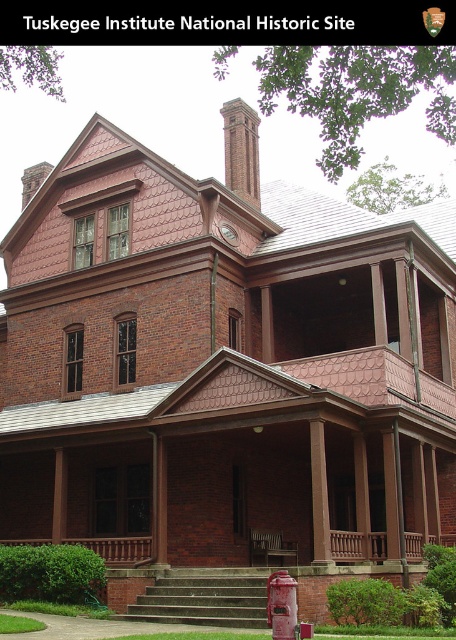
Question: Does brown wood porch at lower center have a smaller size compared to rustic metal fire hydrant at lower center?

Choices:
 (A) no
 (B) yes

Answer: (A)

Question: Does rustic metal fire hydrant at lower center have a larger size compared to metallic silver bench at center?

Choices:
 (A) yes
 (B) no

Answer: (B)

Question: Among these points, which one is farthest from the camera?

Choices:
 (A) (310, 630)
 (B) (280, 556)

Answer: (B)

Question: Which point is closer to the camera?

Choices:
 (A) (299, 634)
 (B) (70, 538)

Answer: (A)

Question: Does metallic silver bench at center come behind metallic red phone box at lower center?

Choices:
 (A) yes
 (B) no

Answer: (A)

Question: Estimate the real-world distances between objects in this image. Which object is farther from the metallic silver bench at center?

Choices:
 (A) brown wood porch at lower center
 (B) metallic red phone box at lower center
 (C) rustic metal fire hydrant at lower center

Answer: (C)